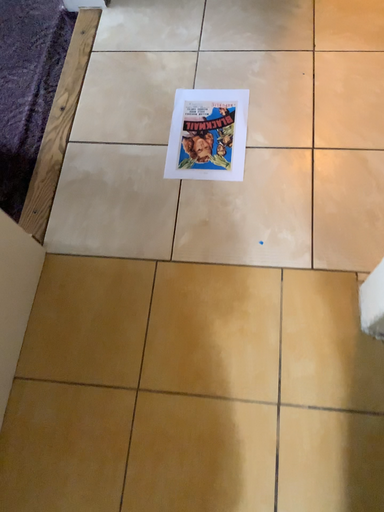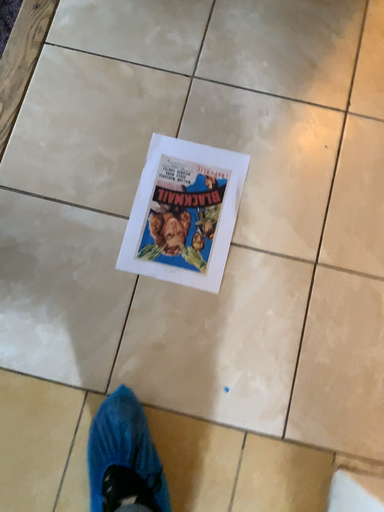
Question: How did the camera likely rotate when shooting the video?

Choices:
 (A) rotated downward
 (B) rotated upward

Answer: (A)